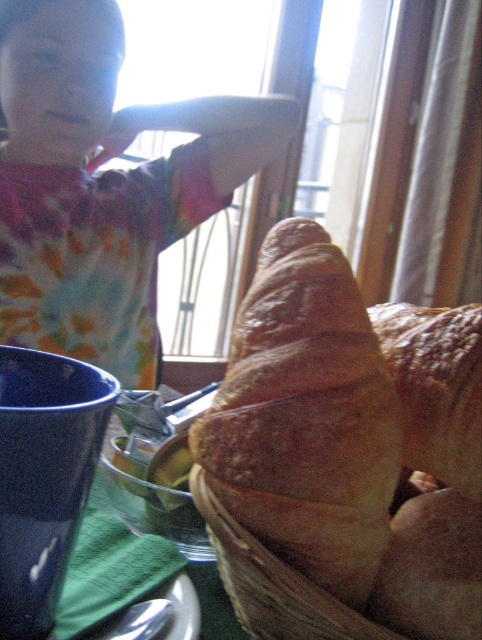
Looking at this image, which of these two, tie-dye fabric shirt at upper left or golden brown flaky croissant at lower right, stands taller?

Standing taller between the two is tie-dye fabric shirt at upper left.

Does tie-dye fabric shirt at upper left have a larger size compared to golden brown flaky croissant at lower right?

Yes.

Is point (13, 97) farther from viewer compared to point (412, 353)?

Yes, point (13, 97) is farther from viewer.

Locate an element on the screen. tie-dye fabric shirt at upper left is located at coordinates (102, 182).

Can you confirm if golden brown flaky croissant at center is thinner than golden brown flaky croissant at lower right?

Incorrect, golden brown flaky croissant at center's width is not less than golden brown flaky croissant at lower right's.

Is golden brown flaky croissant at center positioned behind golden brown flaky croissant at lower right?

No.

What do you see at coordinates (306, 417) in the screenshot? I see `golden brown flaky croissant at center` at bounding box center [306, 417].

Where is `golden brown flaky croissant at center`? The height and width of the screenshot is (640, 482). golden brown flaky croissant at center is located at coordinates (306, 417).

Which is in front, point (80, 40) or point (360, 474)?

Point (360, 474) is in front.

Locate an element on the screen. The height and width of the screenshot is (640, 482). tie-dye fabric shirt at upper left is located at coordinates (102, 182).

This screenshot has height=640, width=482. Find the location of `tie-dye fabric shirt at upper left`. tie-dye fabric shirt at upper left is located at coordinates (102, 182).